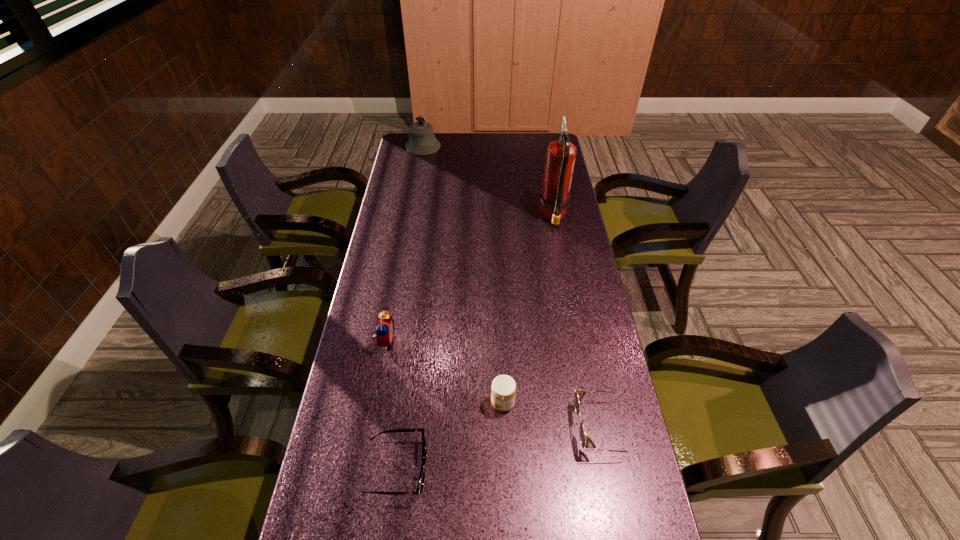
Find the location of `vacant space that is in between the farthest object and the third tallest object`. vacant space that is in between the farthest object and the third tallest object is located at coordinates tap(404, 244).

The height and width of the screenshot is (540, 960). I want to click on free space between the third object from right to left and the fifth tallest object, so click(x=553, y=415).

Identify the location of object that is the closest to the second tallest object. (560, 155).

Locate an element on the screen. This screenshot has width=960, height=540. object that is the nearest to the alarm clock is located at coordinates (420, 485).